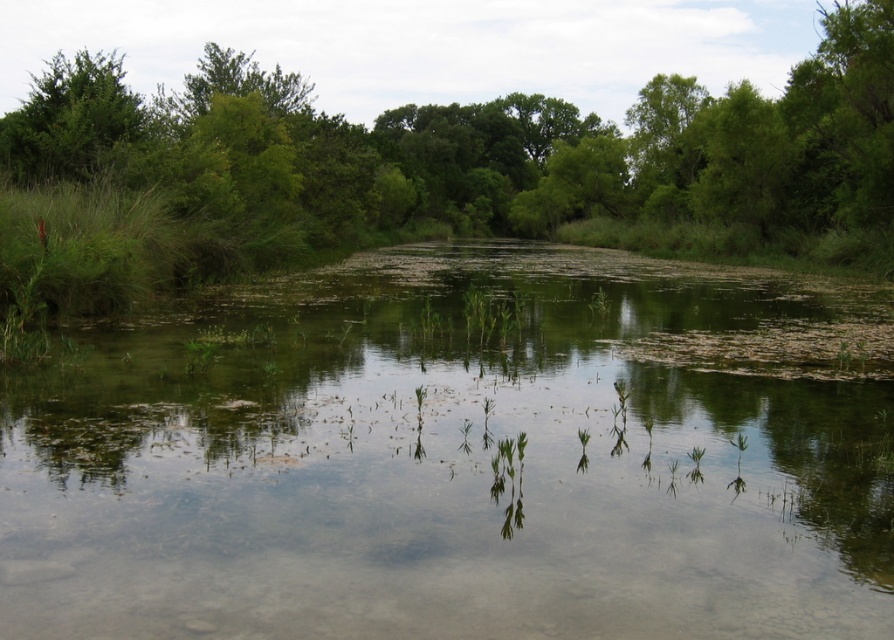
Where is `clear water at center`? This screenshot has width=894, height=640. clear water at center is located at coordinates (462, 458).

Does clear water at center have a lesser width compared to green leafy tree at upper left?

Yes, clear water at center is thinner than green leafy tree at upper left.

Find the location of a particular element. clear water at center is located at coordinates (462, 458).